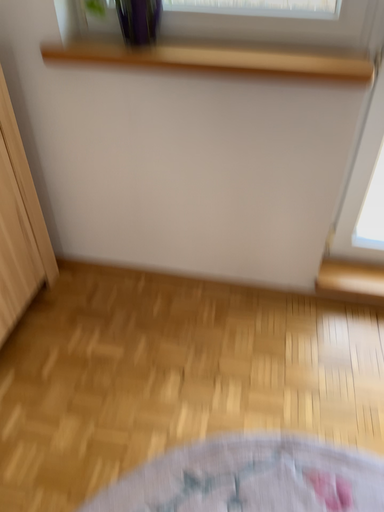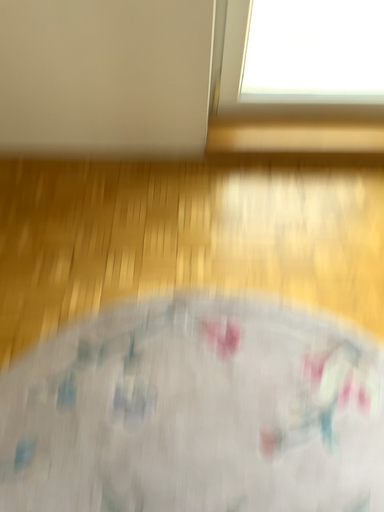
Question: How did the camera likely rotate when shooting the video?

Choices:
 (A) rotated downward
 (B) rotated upward

Answer: (A)